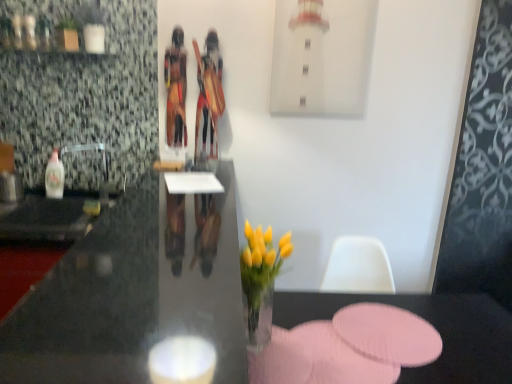
Question: Considering the relative positions of pink fabric placemat at lower center and wooden tribal figure at center, placed as the 1th person when sorted from left to right, in the image provided, is pink fabric placemat at lower center in front of wooden tribal figure at center, placed as the 1th person when sorted from left to right,?

Choices:
 (A) yes
 (B) no

Answer: (A)

Question: From the image's perspective, is pink fabric placemat at lower center located beneath wooden tribal figure at center, the second person positioned from the right?

Choices:
 (A) no
 (B) yes

Answer: (B)

Question: From a real-world perspective, is pink fabric placemat at lower center located beneath wooden tribal figure at center, placed as the 1th person when sorted from left to right?

Choices:
 (A) yes
 (B) no

Answer: (A)

Question: Is pink fabric placemat at lower center shorter than wooden tribal figure at center, the second person positioned from the right?

Choices:
 (A) no
 (B) yes

Answer: (B)

Question: Is pink fabric placemat at lower center smaller than wooden tribal figure at center, placed as the 1th person when sorted from left to right?

Choices:
 (A) yes
 (B) no

Answer: (B)

Question: Is pink fabric placemat at lower center bigger than wooden tribal figure at center, the second person positioned from the right?

Choices:
 (A) no
 (B) yes

Answer: (B)

Question: Is black glossy desk at center aimed at translucent plastic bottle at left?

Choices:
 (A) no
 (B) yes

Answer: (A)

Question: Is black glossy desk at center outside of translucent plastic bottle at left?

Choices:
 (A) no
 (B) yes

Answer: (B)

Question: From the image's perspective, does black glossy desk at center appear higher than translucent plastic bottle at left?

Choices:
 (A) yes
 (B) no

Answer: (B)

Question: Is black glossy desk at center wider than translucent plastic bottle at left?

Choices:
 (A) no
 (B) yes

Answer: (B)

Question: From a real-world perspective, is black glossy desk at center below translucent plastic bottle at left?

Choices:
 (A) no
 (B) yes

Answer: (A)

Question: Does black glossy desk at center have a lesser width compared to translucent plastic bottle at left?

Choices:
 (A) yes
 (B) no

Answer: (B)

Question: Is translucent plastic bottle at left a part of wooden tribal figure at center, which appears as the first person when viewed from the right?

Choices:
 (A) no
 (B) yes

Answer: (A)